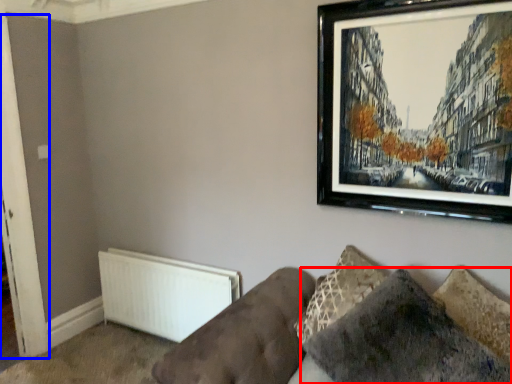
Question: Which object appears closest to the camera in this image, pillow (highlighted by a red box) or door (highlighted by a blue box)?

Choices:
 (A) pillow
 (B) door

Answer: (A)